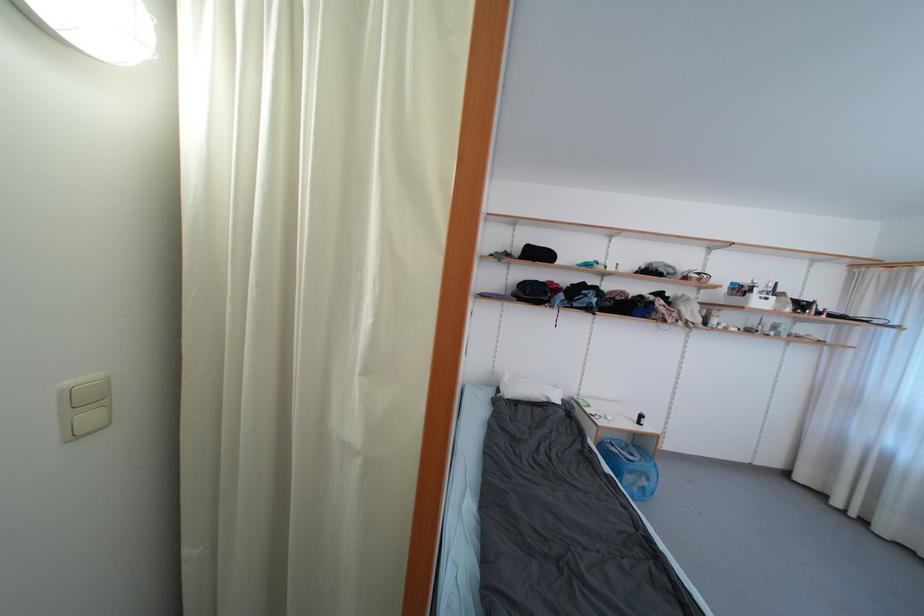
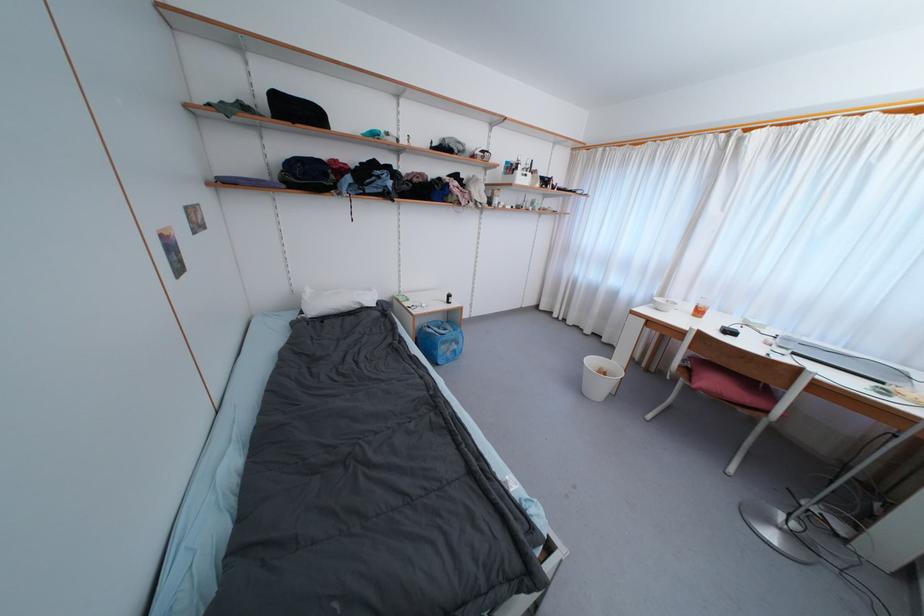
Based on the photo, the first image is from the beginning of the video and the second image is from the end. How did the camera likely rotate when shooting the video?

The rotation direction of the camera is right-down.